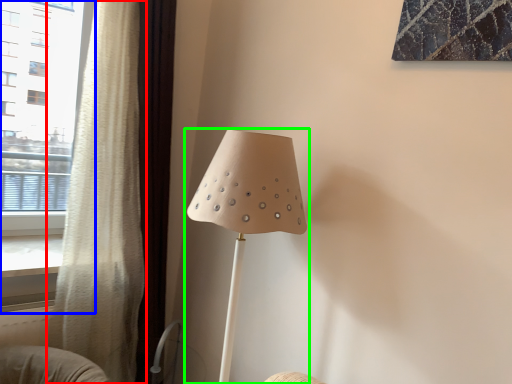
Question: Based on their relative distances, which object is nearer to curtain (highlighted by a red box)? Choose from window (highlighted by a blue box) and lamp (highlighted by a green box).

Choices:
 (A) window
 (B) lamp

Answer: (B)